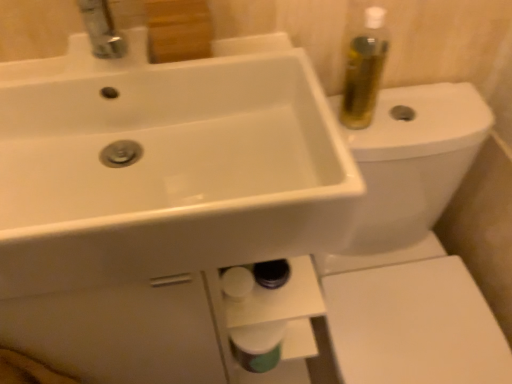
Find the location of `white glossy toilet at upper right`. white glossy toilet at upper right is located at coordinates [412, 249].

The height and width of the screenshot is (384, 512). I want to click on white glossy sink at upper left, so click(x=165, y=168).

Is white glossy toilet paper at lower center oriented away from white glossy sink at upper left?

No, white glossy toilet paper at lower center is not facing the opposite direction of white glossy sink at upper left.

From the image's perspective, is white glossy toilet paper at lower center above or below white glossy sink at upper left?

Clearly, from the image's perspective, white glossy toilet paper at lower center is below white glossy sink at upper left.

From a real-world perspective, between white glossy toilet paper at lower center and white glossy sink at upper left, who is vertically higher?

white glossy sink at upper left, from a real-world perspective.

Considering the relative sizes of white glossy toilet paper at lower center and white glossy sink at upper left in the image provided, is white glossy toilet paper at lower center thinner than white glossy sink at upper left?

Indeed, white glossy toilet paper at lower center has a lesser width compared to white glossy sink at upper left.

Which object is positioned more to the right, white glossy sink at upper left or white glossy toilet paper at lower center?

From the viewer's perspective, white glossy toilet paper at lower center appears more on the right side.

Is point (154, 211) farther from viewer compared to point (265, 328)?

No, (154, 211) is closer to viewer.

Is white glossy sink at upper left completely or partially outside of white glossy toilet paper at lower center?

Absolutely, white glossy sink at upper left is external to white glossy toilet paper at lower center.

Considering their positions, is white glossy sink at upper left located in front of or behind white glossy toilet paper at lower center?

white glossy sink at upper left is positioned closer to the viewer than white glossy toilet paper at lower center.

Where is `sink in front of the white glossy toilet at upper right`? Image resolution: width=512 pixels, height=384 pixels. sink in front of the white glossy toilet at upper right is located at coordinates (165, 168).

From the image's perspective, is white glossy toilet at upper right positioned above or below white glossy sink at upper left?

white glossy toilet at upper right is situated lower than white glossy sink at upper left in the image.

From a real-world perspective, which is physically above, white glossy toilet at upper right or white glossy sink at upper left?

white glossy sink at upper left.

Considering the positions of objects white glossy toilet at upper right and white glossy sink at upper left in the image provided, who is in front, white glossy toilet at upper right or white glossy sink at upper left?

white glossy sink at upper left is more forward.

Is point (300, 107) closer or farther from the camera than point (383, 99)?

Clearly, point (300, 107) is closer to the camera than point (383, 99).

From a real-world perspective, who is located lower, white glossy sink at upper left or white glossy toilet at upper right?

From a 3D spatial view, white glossy toilet at upper right is below.

Is white glossy toilet at upper right located within white glossy sink at upper left?

No, white glossy toilet at upper right is not surrounded by white glossy sink at upper left.

Does white glossy sink at upper left touch white glossy toilet at upper right?

No, white glossy sink at upper left is not making contact with white glossy toilet at upper right.

From a real-world perspective, relative to white glossy toilet at upper right, is white glossy toilet paper at lower center vertically above or below?

From a real-world perspective, white glossy toilet paper at lower center is physically above white glossy toilet at upper right.

Is white glossy toilet paper at lower center beside white glossy toilet at upper right?

white glossy toilet paper at lower center and white glossy toilet at upper right are clearly separated.

Considering the sizes of objects white glossy toilet paper at lower center and white glossy toilet at upper right in the image provided, who is wider, white glossy toilet paper at lower center or white glossy toilet at upper right?

Wider between the two is white glossy toilet at upper right.

Locate an element on the screen. Image resolution: width=512 pixels, height=384 pixels. toilet that is under the white glossy toilet paper at lower center (from a real-world perspective) is located at coordinates [x=412, y=249].

Based on the photo, from the image's perspective, which one is positioned lower, white glossy toilet at upper right or white glossy toilet paper at lower center?

white glossy toilet paper at lower center.

Does point (475, 93) lie behind point (245, 362)?

That is True.

Is white glossy toilet paper at lower center at the back of white glossy toilet at upper right?

white glossy toilet at upper right does not have its back to white glossy toilet paper at lower center.

Does white glossy toilet at upper right appear on the right side of white glossy toilet paper at lower center?

Yes.

You are a GUI agent. You are given a task and a screenshot of the screen. Output one action in this format:
    pyautogui.click(x=<x>, y=<y>)
    Task: Click on the toilet paper below the white glossy sink at upper left (from a real-world perspective)
    The width and height of the screenshot is (512, 384).
    Given the screenshot: What is the action you would take?
    258,345

I want to click on sink lying in front of the white glossy toilet paper at lower center, so click(165, 168).

Based on the photo, based on their spatial positions, is white glossy toilet paper at lower center or white glossy toilet at upper right closer to white glossy sink at upper left?

white glossy toilet paper at lower center.

Considering their positions, is white glossy toilet at upper right positioned further to white glossy sink at upper left than white glossy toilet paper at lower center?

white glossy toilet at upper right.

Looking at the image, which one is located further to white glossy toilet paper at lower center, white glossy sink at upper left or white glossy toilet at upper right?

Among the two, white glossy sink at upper left is located further to white glossy toilet paper at lower center.

Consider the image. Based on their spatial positions, is white glossy toilet paper at lower center or white glossy sink at upper left closer to white glossy toilet at upper right?

Based on the image, white glossy toilet paper at lower center appears to be nearer to white glossy toilet at upper right.

Considering their positions, is white glossy toilet at upper right positioned closer to white glossy toilet paper at lower center than white glossy sink at upper left?

Among the two, white glossy toilet at upper right is located nearer to white glossy toilet paper at lower center.

Looking at the image, which one is located closer to white glossy toilet at upper right, white glossy sink at upper left or white glossy toilet paper at lower center?

white glossy toilet paper at lower center.

The width and height of the screenshot is (512, 384). I want to click on toilet paper situated between white glossy sink at upper left and white glossy toilet at upper right from left to right, so click(x=258, y=345).